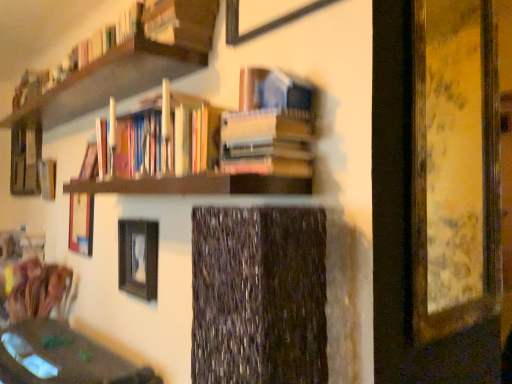
Question: Is matte black picture frame at center, positioned as the third picture frame in front-to-back order, at the left side of matte brown table at lower left?

Choices:
 (A) yes
 (B) no

Answer: (B)

Question: Considering the relative sizes of matte black picture frame at center, positioned as the third picture frame in front-to-back order, and matte brown table at lower left in the image provided, is matte black picture frame at center, positioned as the third picture frame in front-to-back order, bigger than matte brown table at lower left?

Choices:
 (A) no
 (B) yes

Answer: (A)

Question: Is matte black picture frame at center, arranged as the third picture frame when viewed from the right, located outside matte brown table at lower left?

Choices:
 (A) no
 (B) yes

Answer: (B)

Question: From a real-world perspective, is matte black picture frame at center, positioned as the third picture frame in front-to-back order, located higher than matte brown table at lower left?

Choices:
 (A) no
 (B) yes

Answer: (B)

Question: Does matte black picture frame at center, arranged as the third picture frame when viewed from the right, touch matte brown table at lower left?

Choices:
 (A) no
 (B) yes

Answer: (A)

Question: In terms of height, does hardcover book at center, marked as the 3th book in a top-to-bottom arrangement, look taller or shorter compared to wooden picture frame at right, which ranks as the 3th picture frame in back-to-front order?

Choices:
 (A) tall
 (B) short

Answer: (B)

Question: From a real-world perspective, is hardcover book at center, which appears as the first book when ordered from the bottom, positioned above or below wooden picture frame at right, marked as the first picture frame in a right-to-left arrangement?

Choices:
 (A) above
 (B) below

Answer: (B)

Question: Considering the positions of hardcover book at center, marked as the 3th book in a top-to-bottom arrangement, and wooden picture frame at right, which ranks as the 3th picture frame in back-to-front order, in the image, is hardcover book at center, marked as the 3th book in a top-to-bottom arrangement, bigger or smaller than wooden picture frame at right, which ranks as the 3th picture frame in back-to-front order,?

Choices:
 (A) big
 (B) small

Answer: (B)

Question: From the image's perspective, is hardcover book at center, marked as the 3th book in a top-to-bottom arrangement, above or below wooden picture frame at right, the 2th picture frame when ordered from front to back?

Choices:
 (A) below
 (B) above

Answer: (A)

Question: In the image, is wooden frame at upper center, which ranks as the 4th picture frame in back-to-front order, positioned in front of or behind matte brown table at lower left?

Choices:
 (A) behind
 (B) front

Answer: (B)

Question: Is wooden frame at upper center, which is the 2th picture frame in right-to-left order, inside the boundaries of matte brown table at lower left, or outside?

Choices:
 (A) inside
 (B) outside

Answer: (B)

Question: Based on their positions, is wooden frame at upper center, which ranks as the 4th picture frame in back-to-front order, located to the left or right of matte brown table at lower left?

Choices:
 (A) right
 (B) left

Answer: (A)

Question: Is wooden frame at upper center, marked as the third picture frame in a left-to-right arrangement, wider or thinner than matte brown table at lower left?

Choices:
 (A) wide
 (B) thin

Answer: (B)

Question: Considering the relative positions of hardcover book at center, which appears as the first book when ordered from the bottom, and wooden swivel chair at lower left in the image provided, is hardcover book at center, which appears as the first book when ordered from the bottom, to the left or to the right of wooden swivel chair at lower left?

Choices:
 (A) right
 (B) left

Answer: (A)

Question: Is hardcover book at center, marked as the 3th book in a top-to-bottom arrangement, taller or shorter than wooden swivel chair at lower left?

Choices:
 (A) short
 (B) tall

Answer: (A)